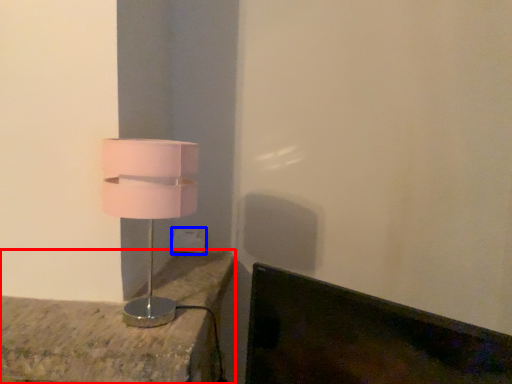
Question: Among these objects, which one is nearest to the camera, furniture (highlighted by a red box) or electric outlet (highlighted by a blue box)?

Choices:
 (A) furniture
 (B) electric outlet

Answer: (A)